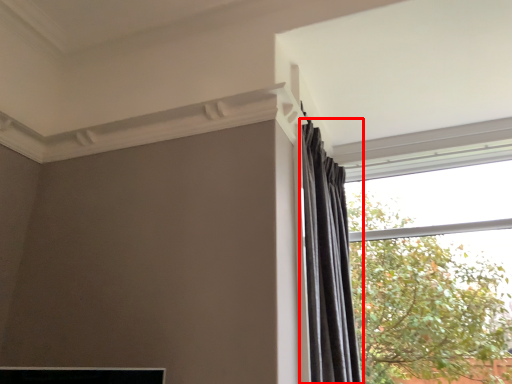
Question: From the image's perspective, considering the relative positions of curtain (annotated by the red box) and window in the image provided, where is curtain (annotated by the red box) located with respect to the staircase?

Choices:
 (A) below
 (B) above

Answer: (B)